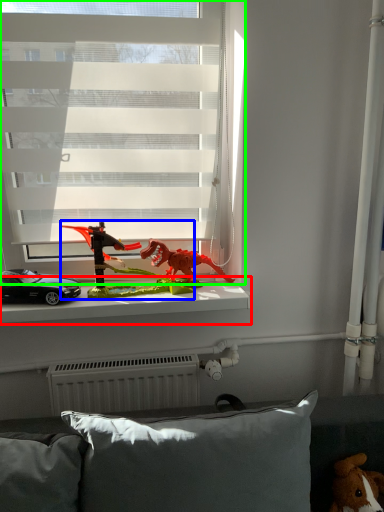
Question: Estimate the real-world distances between objects in this image. Which object is farther from window sill (highlighted by a red box), toy (highlighted by a blue box) or window (highlighted by a green box)?

Choices:
 (A) toy
 (B) window

Answer: (B)